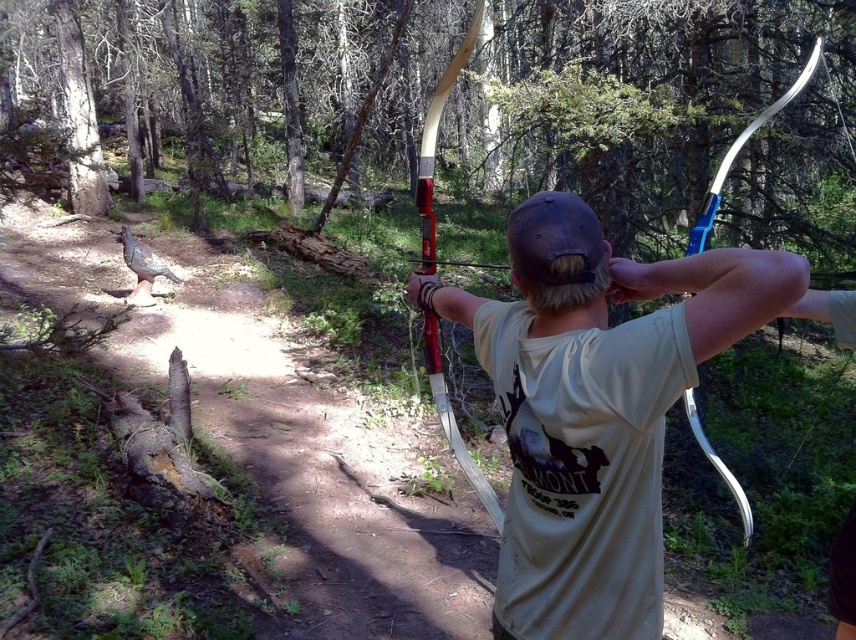
Question: Among these objects, which one is farthest from the camera?

Choices:
 (A) matte white t-shirt at center
 (B) wooden bow at center

Answer: (B)

Question: Can you confirm if matte white t-shirt at center is smaller than wooden bow at center?

Choices:
 (A) yes
 (B) no

Answer: (A)

Question: Is matte white t-shirt at center to the right of wooden bow at center from the viewer's perspective?

Choices:
 (A) no
 (B) yes

Answer: (A)

Question: Among these points, which one is farthest from the camera?

Choices:
 (A) (456, 320)
 (B) (437, 378)

Answer: (B)

Question: Considering the relative positions of matte white t-shirt at center and wooden bow at center in the image provided, where is matte white t-shirt at center located with respect to wooden bow at center?

Choices:
 (A) right
 (B) left

Answer: (B)